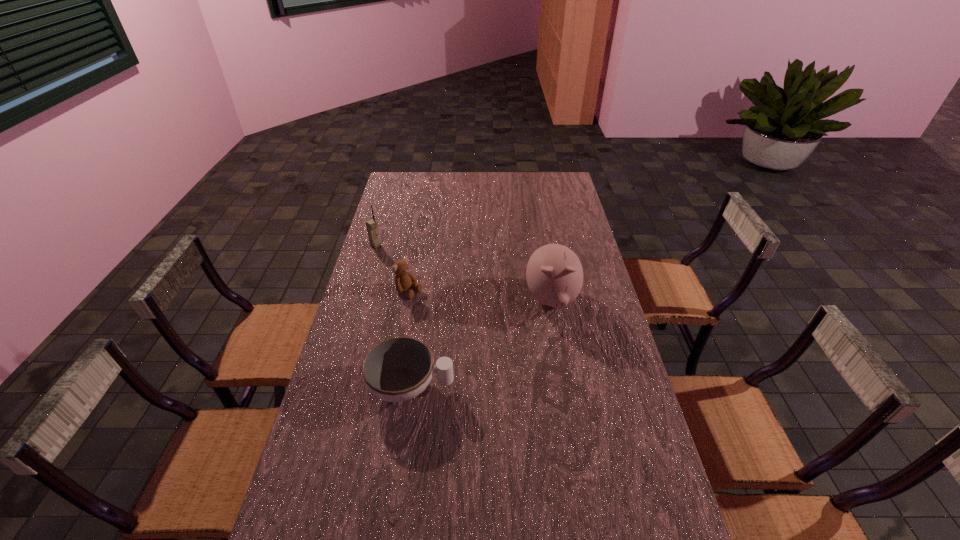
This screenshot has width=960, height=540. I want to click on vacant space on the desktop that is between the shortest object and the piggy bank and is positioned on the front-facing side of the teddy bear, so click(x=491, y=337).

Identify the location of free spot on the desktop that is between the shortest object and the piggy bank and is positioned on the front of the farthest object, where the keypad is located. This screenshot has width=960, height=540. (493, 335).